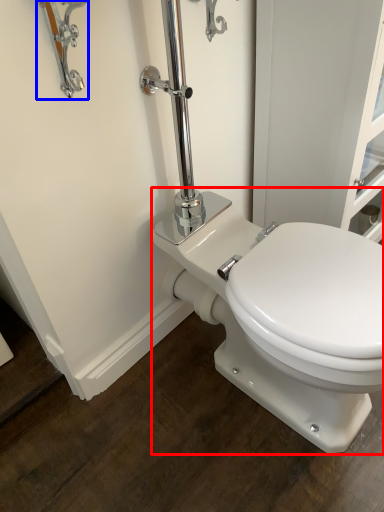
Question: Among these objects, which one is nearest to the camera, toilet (highlighted by a red box) or faucet (highlighted by a blue box)?

Choices:
 (A) toilet
 (B) faucet

Answer: (B)